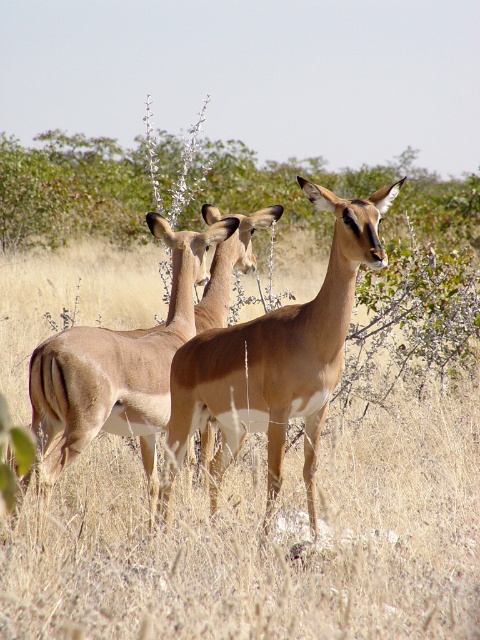
Is the position of brown dry grass at center more distant than that of light brown fur at center?

No.

Between point (1, 291) and point (172, 429), which one is positioned behind?

The point (1, 291) is behind.

This screenshot has width=480, height=640. I want to click on brown dry grass at center, so click(x=264, y=538).

Is light brown fur at center in front of light brown fur antelope at center?

Yes, light brown fur at center is in front of light brown fur antelope at center.

Is light brown fur at center bigger than light brown fur antelope at center?

Yes.

Which is in front, point (204, 358) or point (182, 264)?

Point (204, 358)

Locate an element on the screen. light brown fur at center is located at coordinates (276, 358).

Describe the element at coordinates (264, 538) in the screenshot. I see `brown dry grass at center` at that location.

Between point (469, 593) and point (129, 369), which one is positioned behind?

Positioned behind is point (129, 369).

Is point (73, 529) farther from viewer compared to point (179, 230)?

No, (73, 529) is in front of (179, 230).

Identify the location of brown dry grass at center. (264, 538).